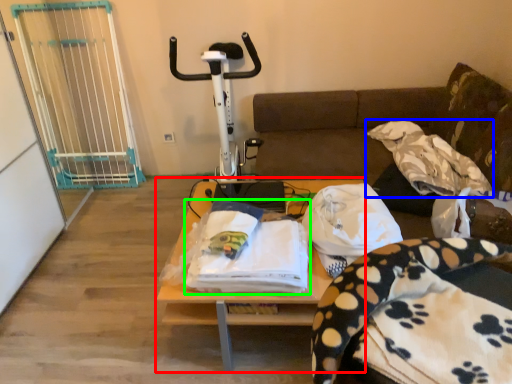
Question: Considering the real-world distances, which object is closest to table (highlighted by a red box)? blanket (highlighted by a blue box) or blanket (highlighted by a green box).

Choices:
 (A) blanket
 (B) blanket

Answer: (B)